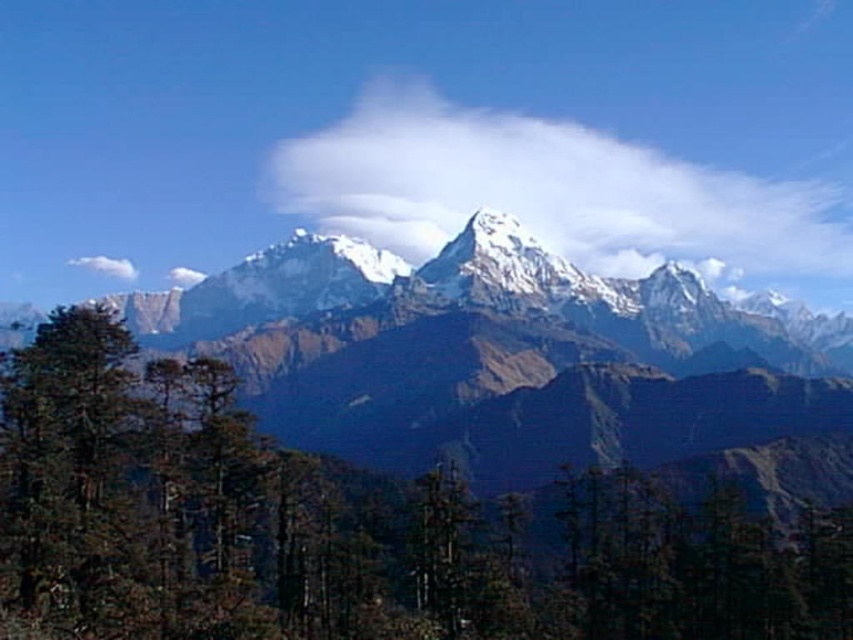
Question: Considering the relative positions of green matte tree at center and white fluffy cloud at center in the image provided, where is green matte tree at center located with respect to white fluffy cloud at center?

Choices:
 (A) below
 (B) above

Answer: (A)

Question: Which of the following is the closest to the observer?

Choices:
 (A) green matte tree at center
 (B) white fluffy cloud at upper center

Answer: (A)

Question: Does white fluffy cloud at center lie in front of white fluffy cloud at upper center?

Choices:
 (A) yes
 (B) no

Answer: (A)

Question: Which point is closer to the camera taking this photo?

Choices:
 (A) (123, 260)
 (B) (503, 204)

Answer: (B)

Question: Can you confirm if white fluffy cloud at center is positioned to the right of white fluffy cloud at upper center?

Choices:
 (A) no
 (B) yes

Answer: (B)

Question: Which point is farther to the camera?

Choices:
 (A) white fluffy cloud at upper center
 (B) green matte tree at center
 (C) white fluffy cloud at center

Answer: (A)